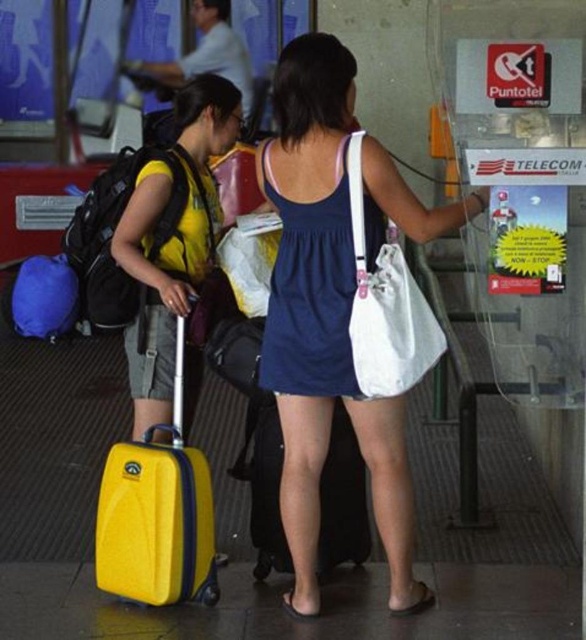
You are a delivery robot with a 30 inch wide package that needs to be moved through the space between the white canvas bag at center and the yellow matte suitcase at left. Can the package fit through the space between these two objects?

The distance between the white canvas bag at center and the yellow matte suitcase at left is 29.15 inches. Since the package is 30 inches wide, it cannot fit through the space between them.

You are a delivery person who needs to place a small package between the white canvas bag at center and the yellow matte suitcase at left. Can you fit it there?

The white canvas bag at center is located below the yellow matte suitcase at left, so there is no space between them for the package.